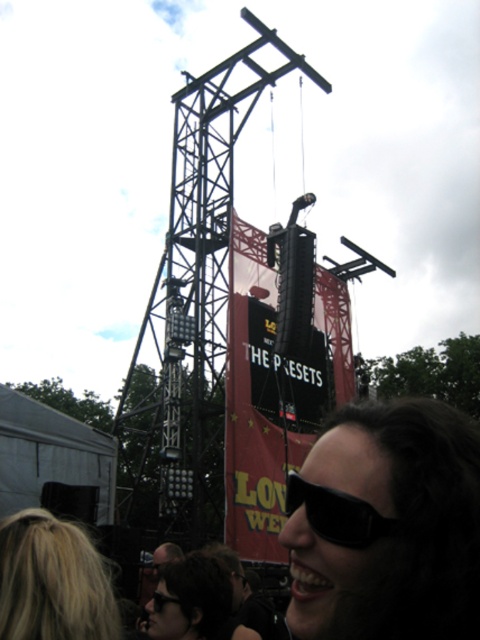
Question: Does matte black sunglasses at lower center have a larger size compared to black plastic goggles at lower center?

Choices:
 (A) no
 (B) yes

Answer: (B)

Question: Which object is farther from the camera taking this photo?

Choices:
 (A) black matte sunglasses at lower center
 (B) blonde hair at lower left
 (C) black plastic goggles at lower center
 (D) black matte scoreboard at center

Answer: (D)

Question: Does black matte sunglasses at lower center have a larger size compared to black plastic goggles at lower center?

Choices:
 (A) no
 (B) yes

Answer: (B)

Question: Is blonde hair at lower left in front of black plastic goggles at lower center?

Choices:
 (A) yes
 (B) no

Answer: (A)

Question: Which point is closer to the camera?

Choices:
 (A) black plastic goggles at lower center
 (B) black matte sunglasses at lower center

Answer: (B)

Question: Which object appears closest to the camera in this image?

Choices:
 (A) blonde hair at lower left
 (B) black plastic goggles at lower center
 (C) black matte sunglasses at lower center

Answer: (A)